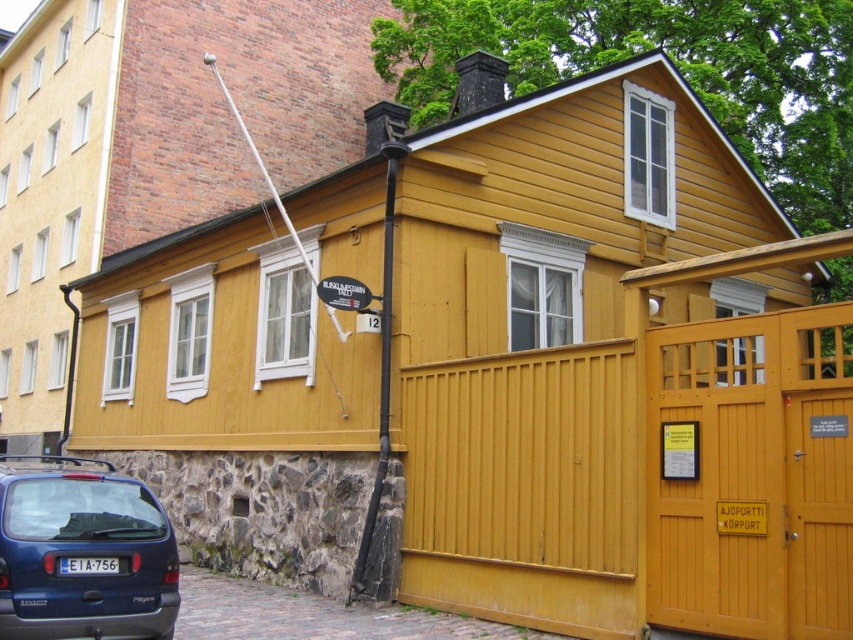
Which of these two, matte blue hatchback at lower left or black metal pole at center, stands shorter?

matte blue hatchback at lower left

Between matte blue hatchback at lower left and black metal pole at center, which one is positioned lower?

matte blue hatchback at lower left is lower down.

Image resolution: width=853 pixels, height=640 pixels. Describe the element at coordinates (82, 552) in the screenshot. I see `matte blue hatchback at lower left` at that location.

Locate an element on the screen. This screenshot has width=853, height=640. matte blue hatchback at lower left is located at coordinates (82, 552).